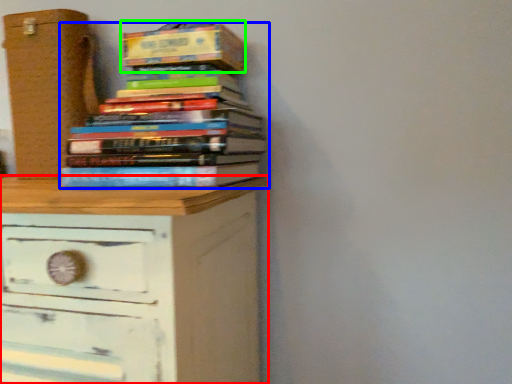
Question: Which is farther away from chest of drawers (highlighted by a red box)? book (highlighted by a blue box) or paperback book (highlighted by a green box)?

Choices:
 (A) book
 (B) paperback book

Answer: (B)